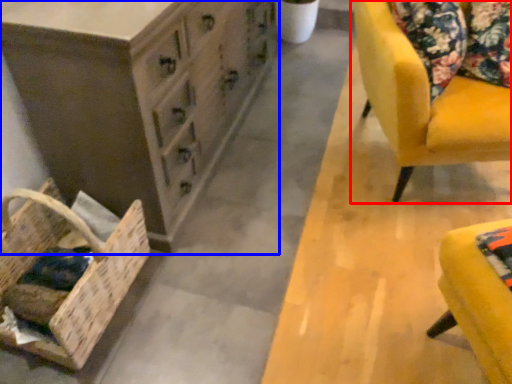
Question: Among these objects, which one is nearest to the camera, chair (highlighted by a red box) or chest of drawers (highlighted by a blue box)?

Choices:
 (A) chair
 (B) chest of drawers

Answer: (B)